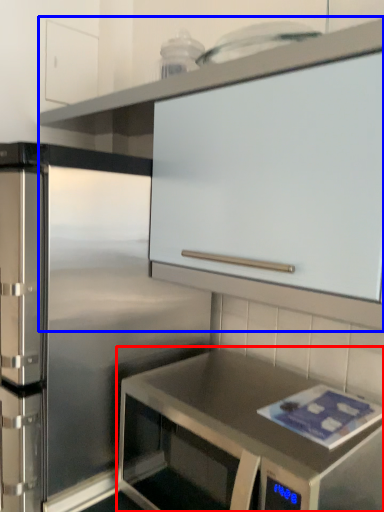
Question: Which point is further to the camera, countertop (highlighted by a red box) or cabinetry (highlighted by a blue box)?

Choices:
 (A) countertop
 (B) cabinetry

Answer: (A)